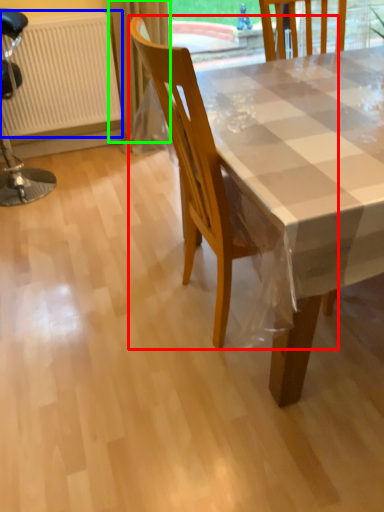
Question: Which is nearer to the chair (highlighted by a red box)? radiator (highlighted by a blue box) or curtain (highlighted by a green box).

Choices:
 (A) radiator
 (B) curtain

Answer: (B)